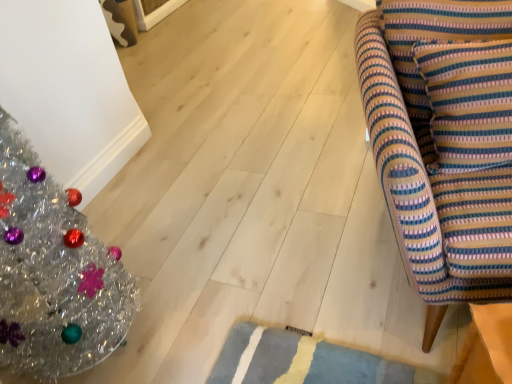
Where is `vacant area located to the right-hand side of shiny silver christmas tree at left`? vacant area located to the right-hand side of shiny silver christmas tree at left is located at coordinates (199, 302).